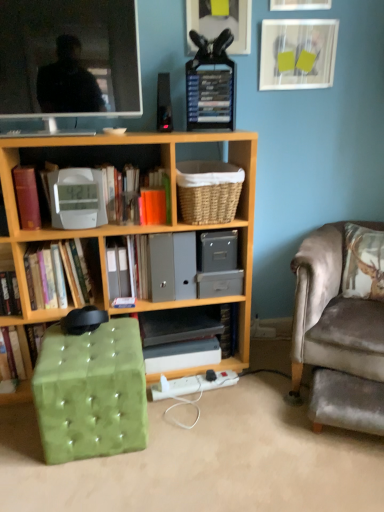
In order to click on free space above green tufted ottoman at lower left (from a real-world perspective) in this screenshot , I will do `click(100, 338)`.